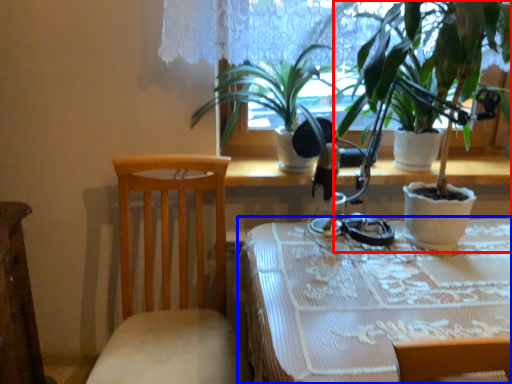
Question: Which object is further to the camera taking this photo, houseplant (highlighted by a red box) or table (highlighted by a blue box)?

Choices:
 (A) houseplant
 (B) table

Answer: (A)